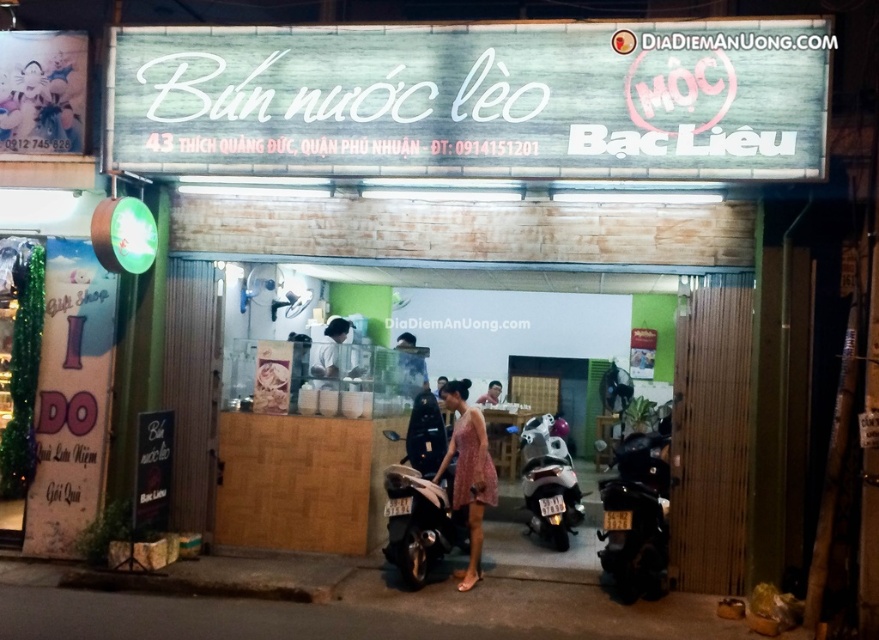
You are a delivery person who needs to park your motorcycle. The parking area has space for only one motorcycle. You see the black matte motorcycle at center and the black matte motorcycle at lower right. Which motorcycle should you move to make space?

You should move the black matte motorcycle at center because it is smaller than the black matte motorcycle at lower right, so moving the smaller one would require less effort and space.

You are a delivery rider who needs to park your motorcycle in a space that is exactly 1.5 meters in height. You see a black glossy motorcycle at lower right and a black matte motorcycle at center. Which motorcycle can fit into the parking space without exceeding the height limit?

The black glossy motorcycle at lower right is not as tall as the black matte motorcycle at center, so the black glossy motorcycle at lower right can fit into the parking space without exceeding the height limit.